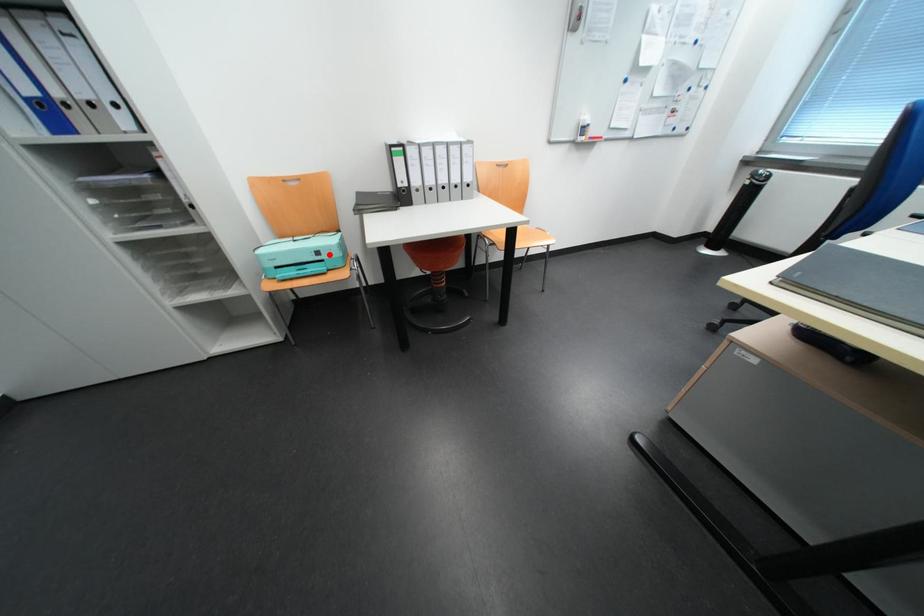
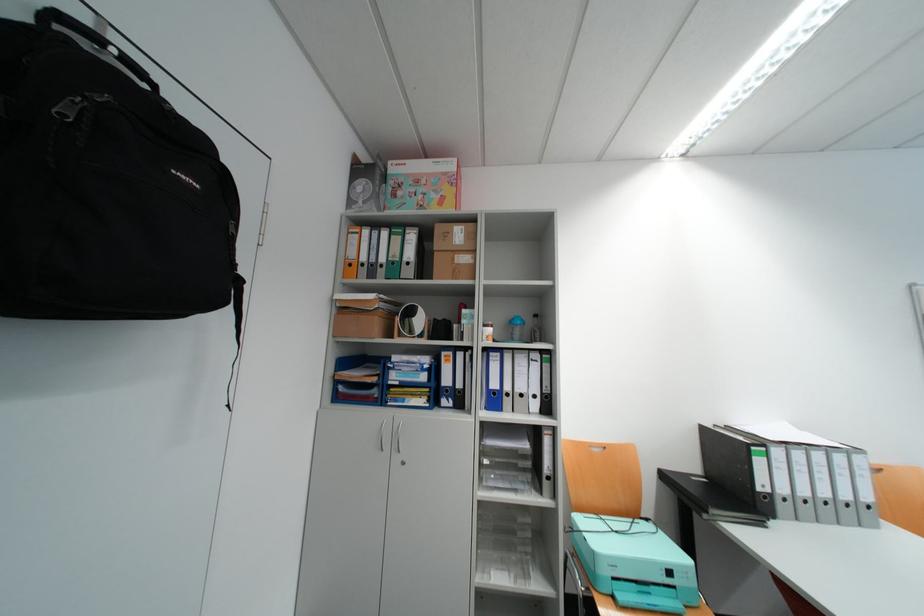
Question: A red point is marked in image1. In image2, is the corresponding 3D point closer to the camera or farther? Reply with the corresponding letter.

Choices:
 (A) The corresponding 3D point is closer.
 (B) The corresponding 3D point is farther.

Answer: (B)